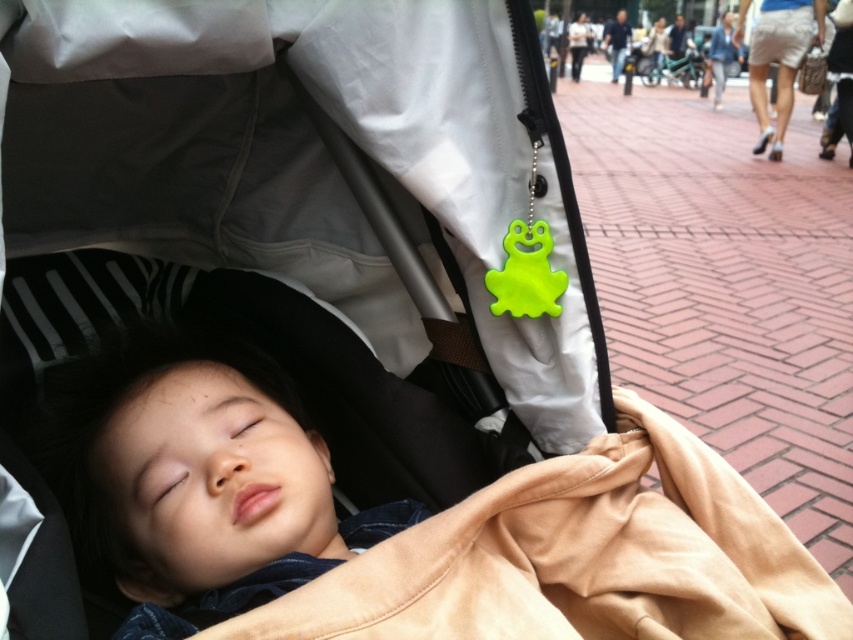
You are a photographer standing in front of the stroller. You notice two points marked on the image. The first point is at coordinate point (444, 161) and the second point is at coordinate point (700, 632). Which point is closer to your camera?

Point (444, 161) is further to the camera than point (700, 632), so the second point is closer to the camera.

You are a babysitter who needs to check if the child is properly covered. Based on the scene, is the smooth beige blanket at center positioned under or over the smooth skin child at center?

The smooth beige blanket at center is located below the smooth skin child at center, so the blanket is positioned under the child.

From the picture: You are a parent who wants to place a small toy inside the matte gray baby carriage at center. Considering the size of the smooth beige blanket at center, will there be enough space left in the carriage after placing the blanket?

The matte gray baby carriage at center is larger in size than the smooth beige blanket at center, so there should be enough space left in the carriage after placing the blanket.